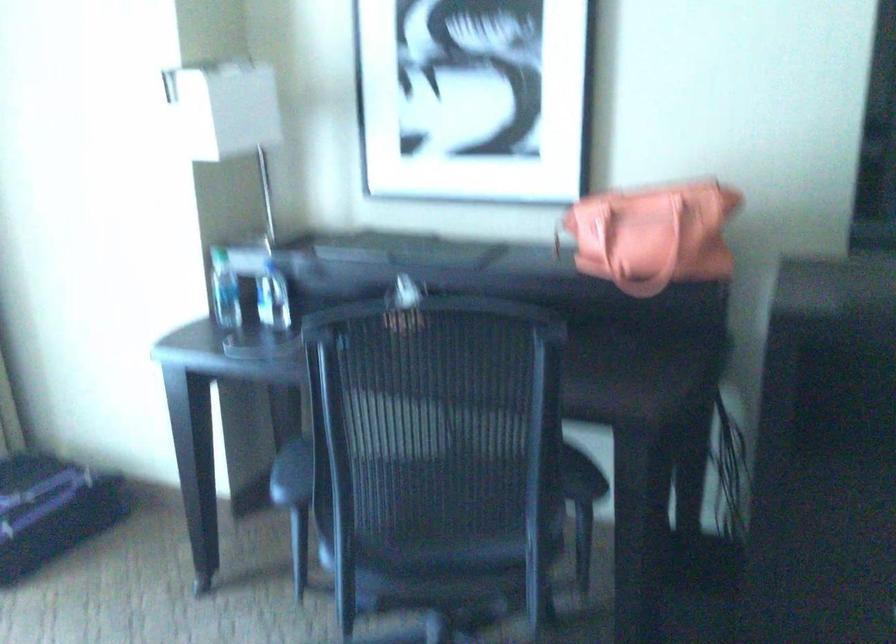
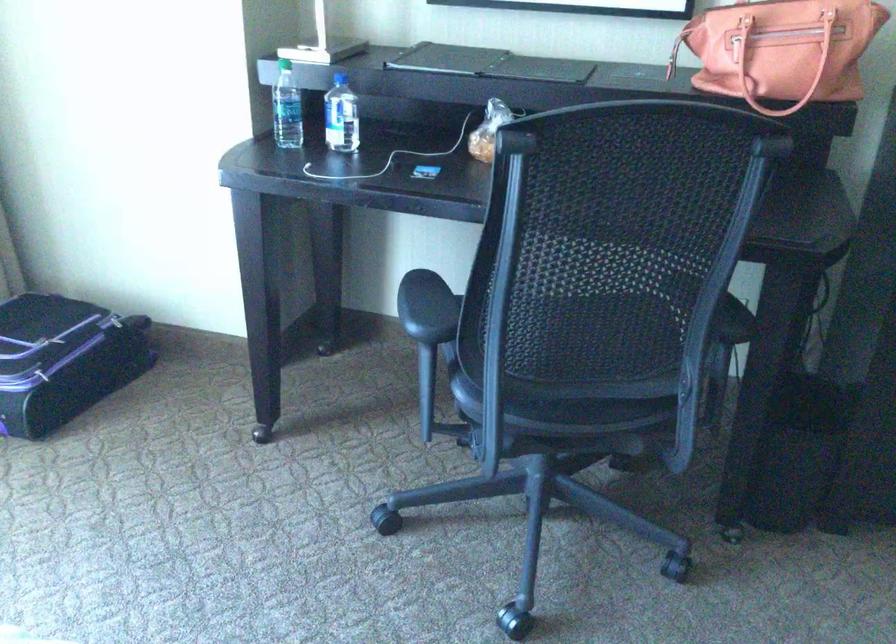
Question: The first image is from the beginning of the video and the second image is from the end. How did the camera likely rotate when shooting the video?

Choices:
 (A) Left
 (B) Right
 (C) Up
 (D) Down

Answer: (D)